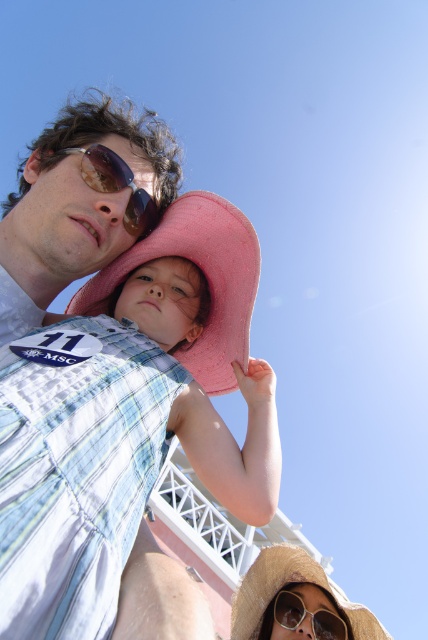
How far apart are matte blue denim vest at upper left and shiny brown goggles at center?

matte blue denim vest at upper left and shiny brown goggles at center are 5.38 feet apart from each other.

Is matte blue denim vest at upper left below shiny brown goggles at center?

No, matte blue denim vest at upper left is not below shiny brown goggles at center.

Measure the distance between point (118, 250) and camera.

18.26 meters

Identify the location of matte blue denim vest at upper left. This screenshot has width=428, height=640. (80, 195).

Who is higher up, pink fabric hat at upper center or white plastic sunglasses at lower center?

pink fabric hat at upper center is above.

Does point (107, 628) lie behind point (338, 627)?

That is False.

Identify the location of pink fabric hat at upper center. (128, 419).

Does point (55, 262) come farther from viewer compared to point (267, 554)?

No, (55, 262) is closer to viewer.

Does matte blue denim vest at upper left lie behind straw hat at upper center?

No, matte blue denim vest at upper left is in front of straw hat at upper center.

Who is more forward, (6, 252) or (243, 596)?

Point (6, 252) is in front.

This screenshot has height=640, width=428. I want to click on matte blue denim vest at upper left, so click(80, 195).